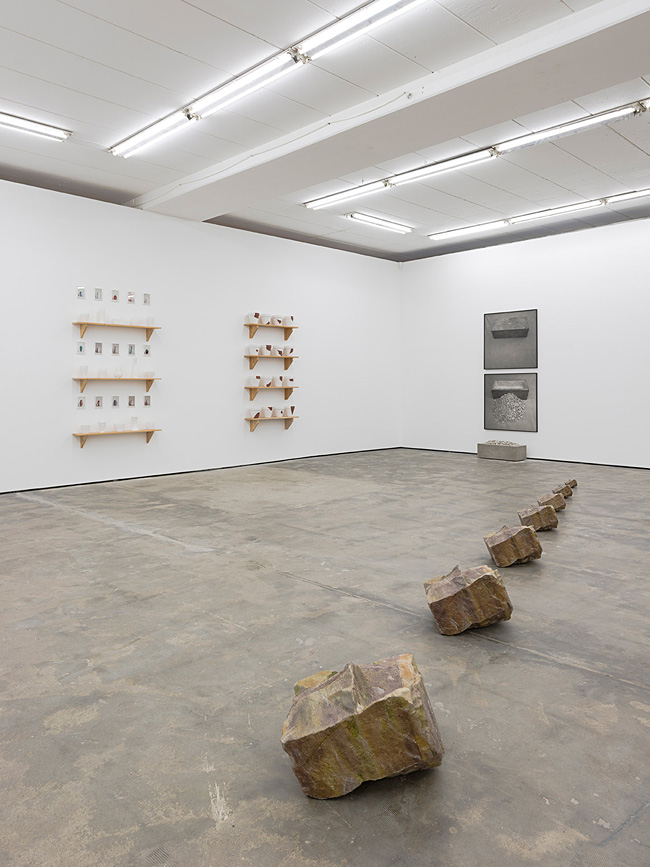
You are a GUI agent. You are given a task and a screenshot of the screen. Output one action in this format:
    pyautogui.click(x=<x>, y=<y>)
    Task: Click on the wooden shelves
    The height and width of the screenshot is (867, 650).
    Given the screenshot: What is the action you would take?
    pyautogui.click(x=268, y=414), pyautogui.click(x=266, y=385), pyautogui.click(x=263, y=356), pyautogui.click(x=261, y=323), pyautogui.click(x=147, y=323), pyautogui.click(x=138, y=375), pyautogui.click(x=140, y=427)